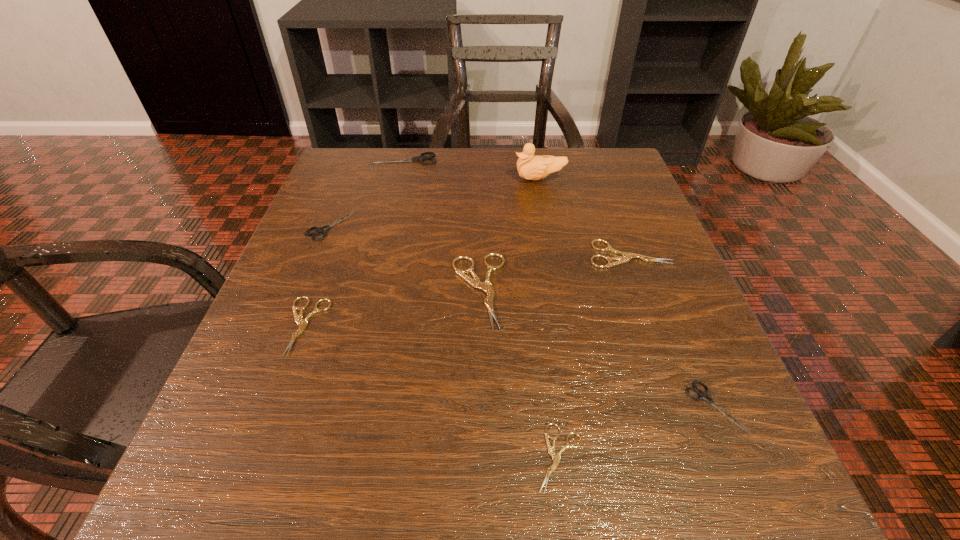
Identify the location of duckling. (530, 167).

I want to click on the seventh nearest object, so click(x=530, y=167).

Where is `the biggest black shears`? the biggest black shears is located at coordinates (420, 158).

Locate an element on the screen. This screenshot has height=540, width=960. the farthest shears is located at coordinates (420, 158).

Where is `the biggest beige shears`? Image resolution: width=960 pixels, height=540 pixels. the biggest beige shears is located at coordinates (486, 286).

Where is `the fourth shears from right to left`? The image size is (960, 540). the fourth shears from right to left is located at coordinates (486, 286).

Locate an element on the screen. This screenshot has width=960, height=540. the second smallest black shears is located at coordinates (319, 230).

This screenshot has width=960, height=540. Identify the location of the second biggest beige shears. (627, 257).

This screenshot has height=540, width=960. I want to click on the third biggest beige shears, so click(x=302, y=323).

You are a GUI agent. You are given a task and a screenshot of the screen. Output one action in this format:
    pyautogui.click(x=<x>, y=<y>)
    Task: Click on the nearest black shears
    This screenshot has width=960, height=540.
    Given the screenshot: What is the action you would take?
    pyautogui.click(x=702, y=395)